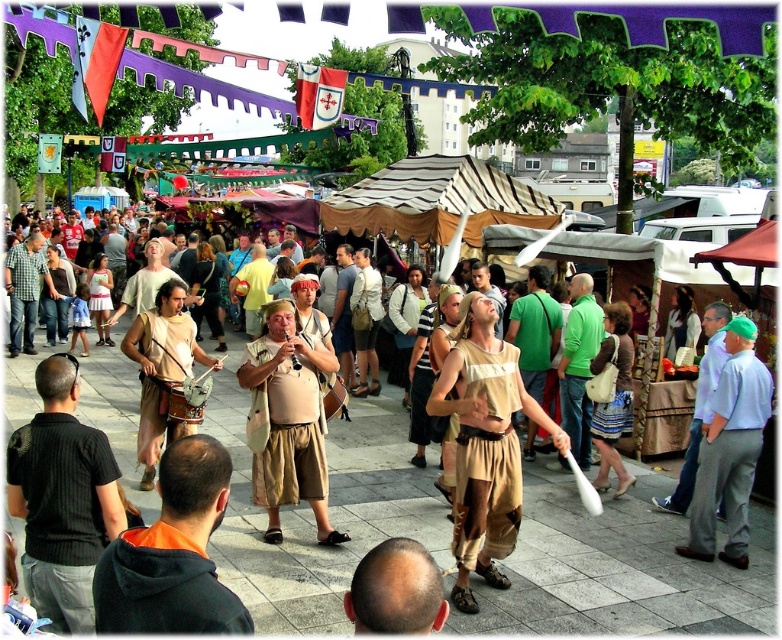
Question: Which point appears farthest from the camera in this image?

Choices:
 (A) (131, 579)
 (B) (321, 497)
 (C) (31, 458)

Answer: (B)

Question: Estimate the real-world distances between objects in this image. Which object is closer to the black cotton shirt at lower left?

Choices:
 (A) smooth bald head at lower center
 (B) light brown leather bag at center
 (C) beige fabric tunic at center
 (D) beige fabric bag at center

Answer: (A)

Question: Is beige fabric hat at center to the left of orange hoodie at lower left from the viewer's perspective?

Choices:
 (A) no
 (B) yes

Answer: (A)

Question: Estimate the real-world distances between objects in this image. Which object is farther from the beige fabric tunic at center?

Choices:
 (A) green cotton shirt at center
 (B) beige linen tunic at center
 (C) smooth bald head at lower center

Answer: (C)

Question: In this image, where is orange hoodie at lower left located relative to beige fabric bag at center?

Choices:
 (A) below
 (B) above

Answer: (A)

Question: Can you confirm if smooth bald head at lower center is positioned below light blue shirt at center?

Choices:
 (A) yes
 (B) no

Answer: (A)